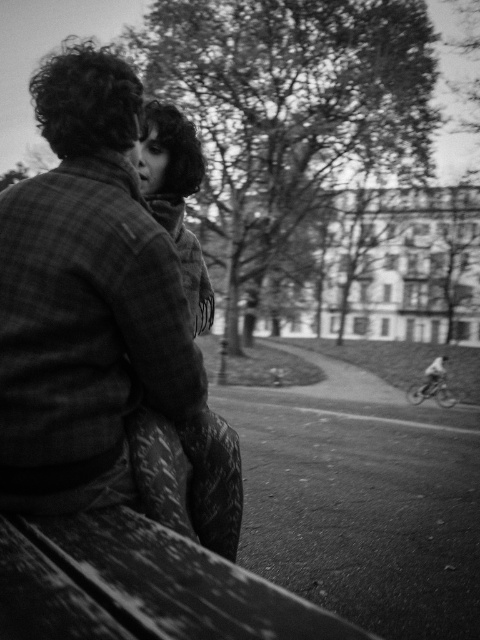
You are a photographer trying to capture a closeup of the person on the left. You notice two scarves at the center of the image, the fluffy scarf at center and the soft wool scarf at center. Which scarf is positioned lower on the person?

The fluffy scarf at center is located below the soft wool scarf at center, so it is positioned lower on the person.

You are a photographer standing at the camera position. You want to capture a closeup shot of the plaid wool coat at center without moving the camera. Is it possible to do so with a standard zoom lens that has a maximum focal length of 200mm?

The plaid wool coat at center is 1.73 meters from the camera. A standard zoom lens with a maximum focal length of 200mm can effectively capture a closeup of the plaid wool coat at center at this distance.